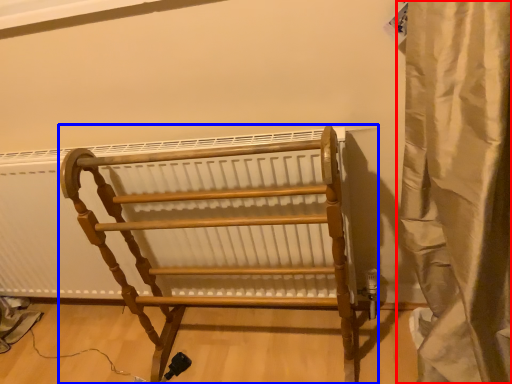
Question: Which of the following is the closest to the observer, curtain (highlighted by a red box) or furniture (highlighted by a blue box)?

Choices:
 (A) curtain
 (B) furniture

Answer: (A)